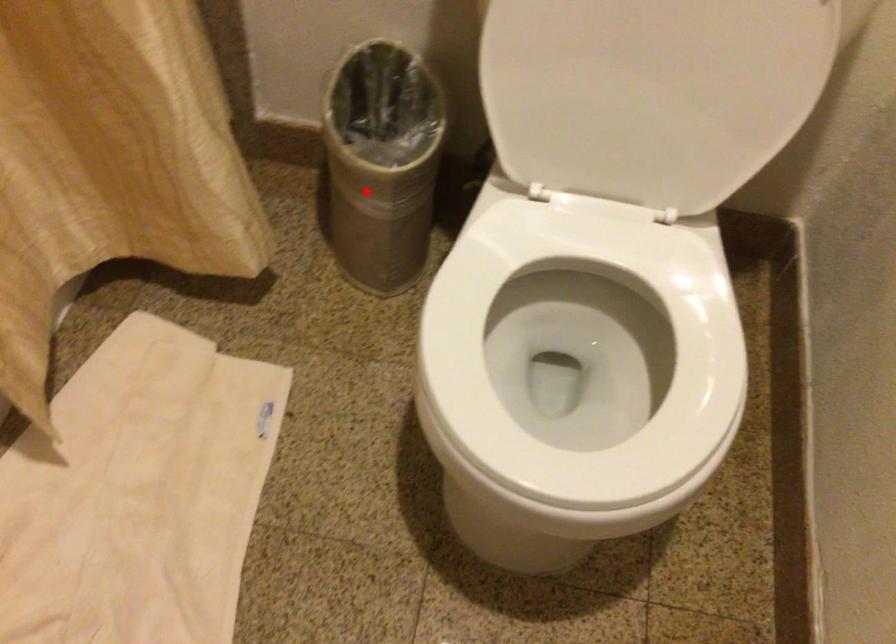
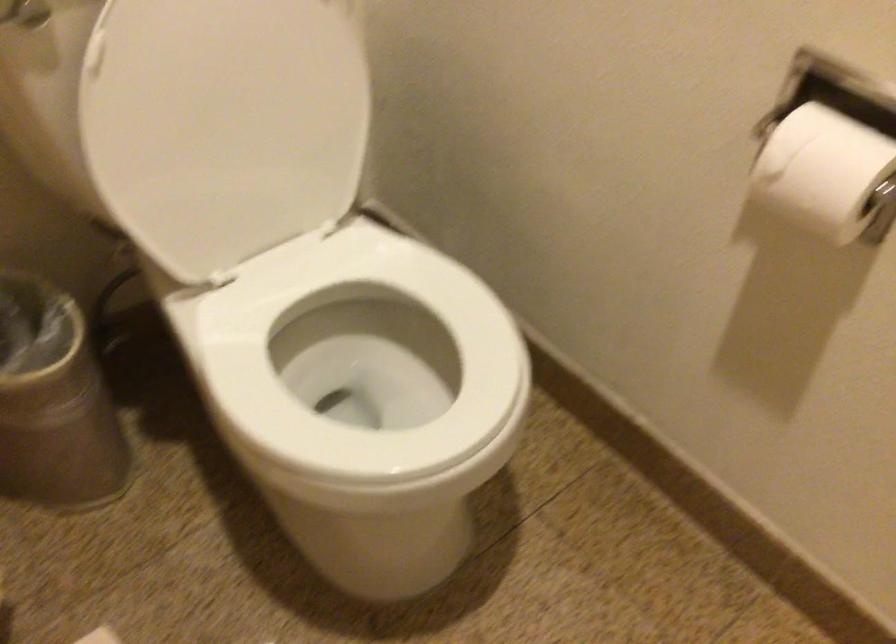
Question: I am providing you with two images of the same scene from different viewpoints. Image1 has a red point marked. In image2, the corresponding 3D location appears at what relative position? Reply with the corresponding letter.

Choices:
 (A) Closer
 (B) Farther

Answer: (A)